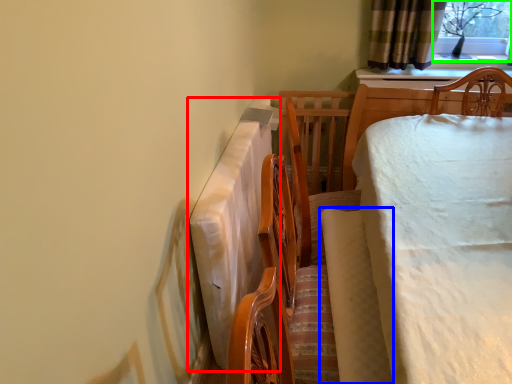
Question: Based on their relative distances, which object is nearer to tablecloth (highlighted by a red box)? Choose from blanket (highlighted by a blue box) and window screen (highlighted by a green box).

Choices:
 (A) blanket
 (B) window screen

Answer: (A)